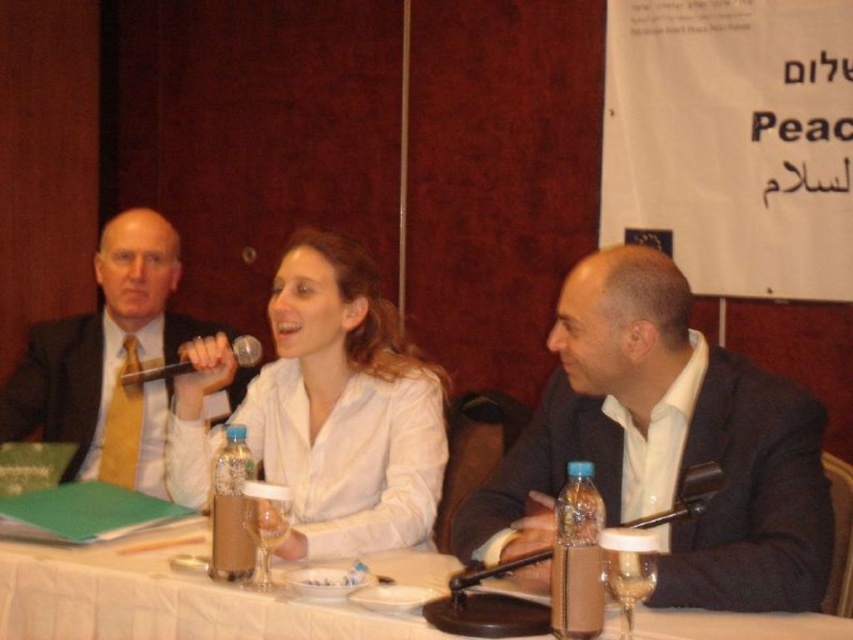
Question: Considering the real-world distances, which object is farthest from the metallic silver microphone at upper center?

Choices:
 (A) matte black jacket at center
 (B) white matte shirt at center
 (C) matte black suit at left
 (D) white plastic table at center

Answer: (A)

Question: Does white matte shirt at center appear over metallic silver microphone at upper center?

Choices:
 (A) yes
 (B) no

Answer: (B)

Question: Which point is closer to the camera?

Choices:
 (A) coord(216,387)
 (B) coord(247,604)
 (C) coord(682,497)
 (D) coord(288,419)

Answer: (C)

Question: Is white plastic table at center in front of metallic silver microphone at upper center?

Choices:
 (A) no
 (B) yes

Answer: (B)

Question: Is white matte shirt at center wider than matte black suit at left?

Choices:
 (A) no
 (B) yes

Answer: (A)

Question: Which of these objects is positioned closest to the metallic silver microphone at upper center?

Choices:
 (A) matte black suit at left
 (B) white matte shirt at center
 (C) matte black jacket at center
 (D) black plastic microphone at lower right

Answer: (B)